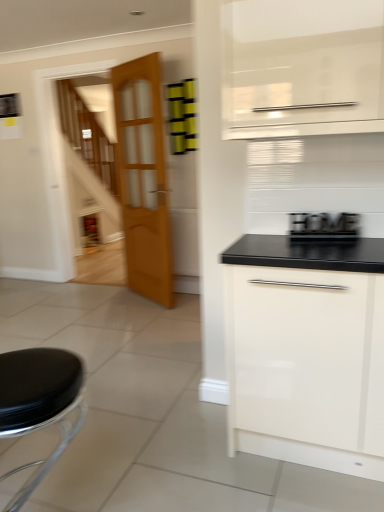
Question: Is black leather stool at lower left bigger or smaller than black wood sign at right?

Choices:
 (A) small
 (B) big

Answer: (B)

Question: From the image's perspective, is black leather stool at lower left positioned above or below black wood sign at right?

Choices:
 (A) below
 (B) above

Answer: (A)

Question: Which object is the closest to the black leather stool at lower left?

Choices:
 (A) black wood sign at right
 (B) white glossy cabinet at lower right
 (C) wooden glass door at center

Answer: (B)

Question: Estimate the real-world distances between objects in this image. Which object is closer to the black leather stool at lower left?

Choices:
 (A) black wood sign at right
 (B) white glossy cabinet at lower right
 (C) wooden glass door at center

Answer: (B)